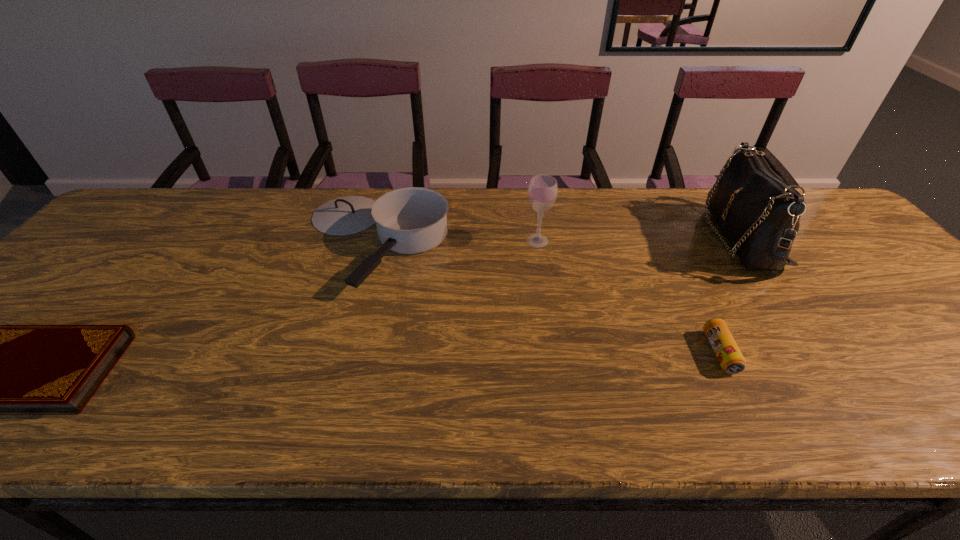
Locate an element on the screen. The height and width of the screenshot is (540, 960). free point between the rightmost object and the beer can is located at coordinates (730, 295).

You are a GUI agent. You are given a task and a screenshot of the screen. Output one action in this format:
    pyautogui.click(x=<x>, y=<y>)
    Task: Click on the vacant area that lies between the beer can and the wineglass
    
    Given the screenshot: What is the action you would take?
    pyautogui.click(x=629, y=296)

At what (x,y) coordinates should I click in order to perform the action: click on unoccupied area between the second shortest object and the wineglass. Please return your answer as a coordinate pair (x, y). Image resolution: width=960 pixels, height=540 pixels. Looking at the image, I should click on (629, 296).

Where is `free spot between the second object from left to right and the second tallest object`? Image resolution: width=960 pixels, height=540 pixels. free spot between the second object from left to right and the second tallest object is located at coordinates (456, 241).

Find the location of a particular element. The image size is (960, 540). empty location between the third shortest object and the tallest object is located at coordinates (558, 240).

This screenshot has width=960, height=540. What are the coordinates of `empty location between the handbag and the second object from right to left` in the screenshot? It's located at (730, 295).

You are a GUI agent. You are given a task and a screenshot of the screen. Output one action in this format:
    pyautogui.click(x=<x>, y=<y>)
    Task: Click on the vacant space in between the second object from right to left and the rightmost object
    
    Given the screenshot: What is the action you would take?
    pyautogui.click(x=730, y=295)

You are a GUI agent. You are given a task and a screenshot of the screen. Output one action in this format:
    pyautogui.click(x=<x>, y=<y>)
    Task: Click on the object identified as the fourth closest to the shortest object
    The height and width of the screenshot is (540, 960).
    Given the screenshot: What is the action you would take?
    pyautogui.click(x=759, y=213)

The height and width of the screenshot is (540, 960). I want to click on object that stands as the fourth closest to the beer can, so 0,369.

Find the location of a particular element. The height and width of the screenshot is (540, 960). vacant region that satisfies the following two spatial constraints: 1. on the back side of the second object from left to right; 2. on the left side of the third object from right to left is located at coordinates (375, 241).